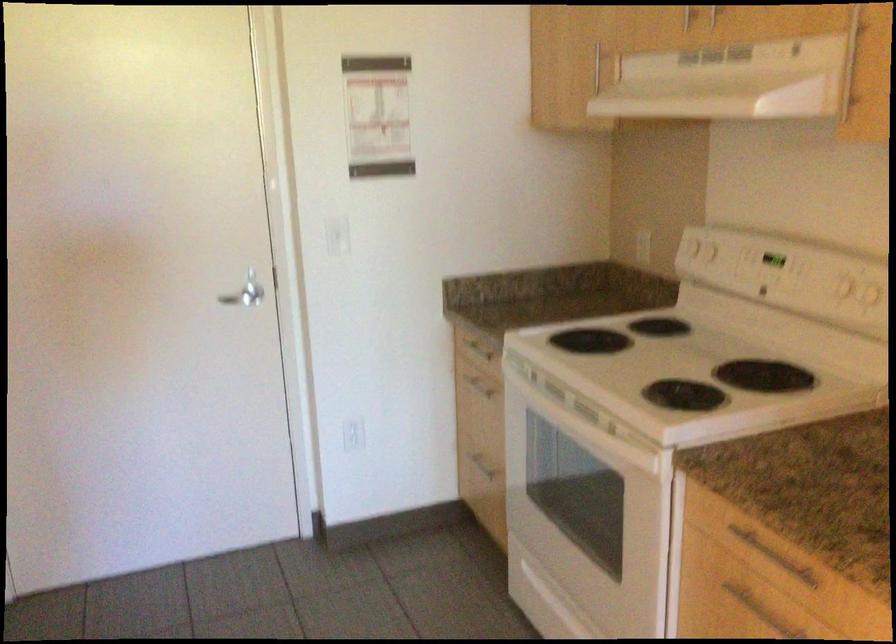
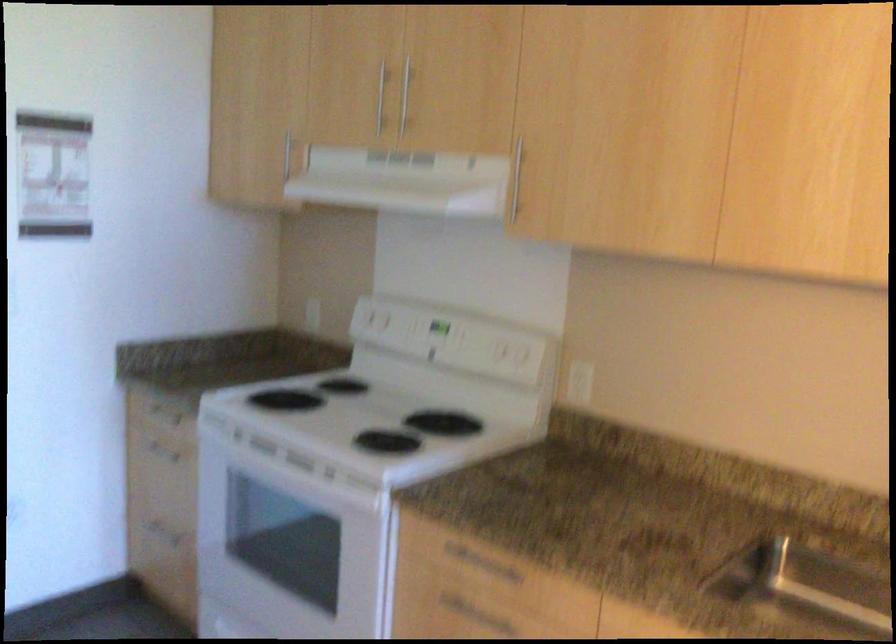
Locate, in the second image, the point that corresponds to pixel 674 363 in the first image.

(367, 415)